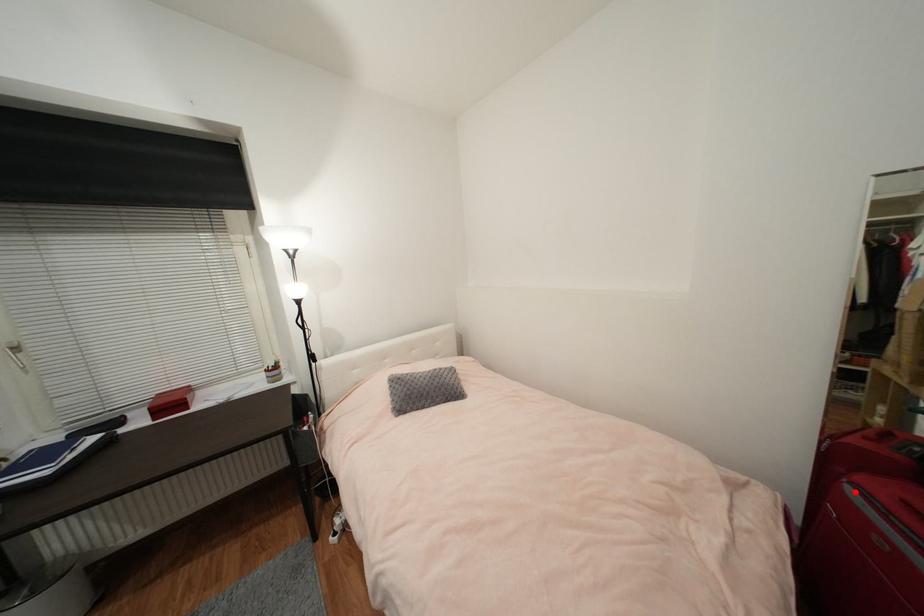
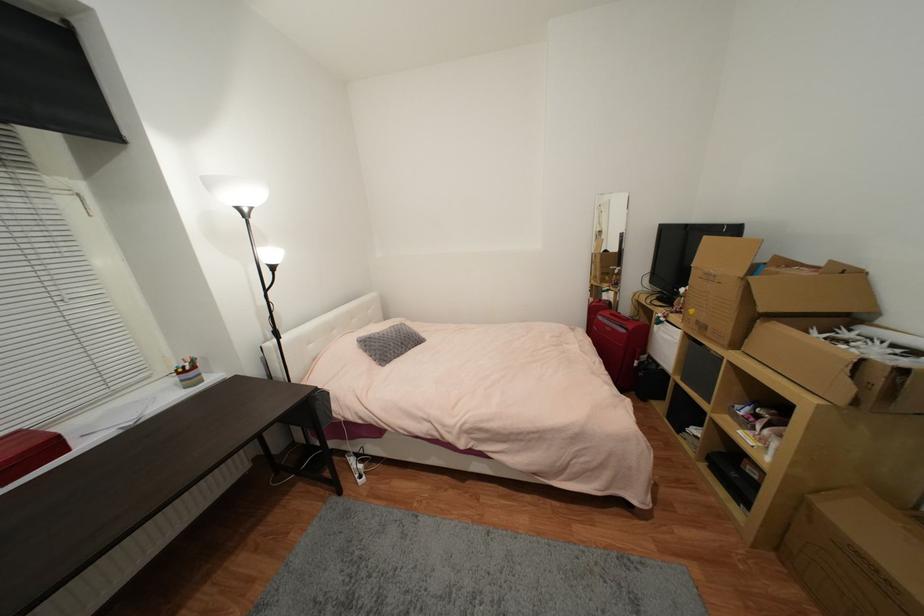
Question: A red point is marked in image1. In image2, is the corresponding 3D point closer to the camera or farther? Reply with the corresponding letter.

Choices:
 (A) The corresponding 3D point is closer.
 (B) The corresponding 3D point is farther.

Answer: (A)